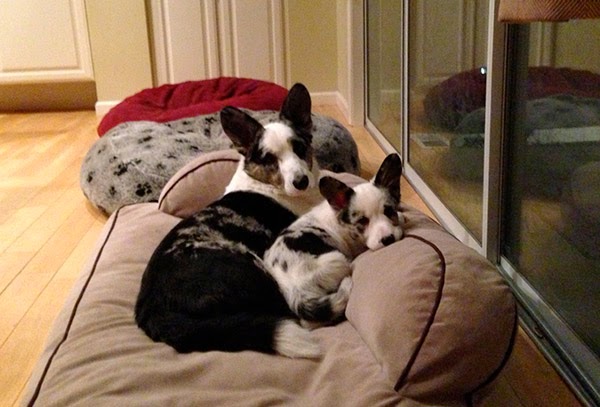
This screenshot has width=600, height=407. Find the location of `glass`. glass is located at coordinates (551, 242).